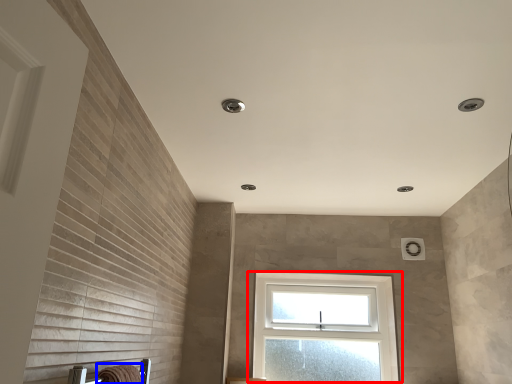
Question: Among these objects, which one is nearest to the camera, window (highlighted by a red box) or bath towel (highlighted by a blue box)?

Choices:
 (A) window
 (B) bath towel

Answer: (B)